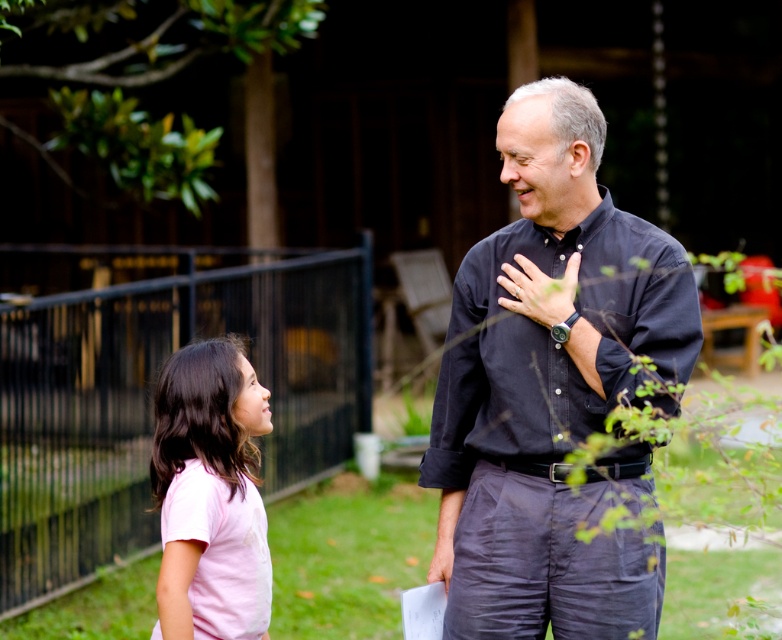
Does dark blue shirt at center have a greater height compared to pink cotton shirt at lower left?

Correct, dark blue shirt at center is much taller as pink cotton shirt at lower left.

Between dark blue shirt at center and pink cotton shirt at lower left, which one has less height?

With less height is pink cotton shirt at lower left.

Does point (474, 525) lie in front of point (246, 502)?

No, it is not.

Image resolution: width=782 pixels, height=640 pixels. I want to click on dark blue shirt at center, so click(x=551, y=392).

Can you confirm if pink cotton shirt at lower left is bigger than matte black watch at center?

Yes, pink cotton shirt at lower left is bigger than matte black watch at center.

Is pink cotton shirt at lower left taller than matte black watch at center?

Indeed, pink cotton shirt at lower left has a greater height compared to matte black watch at center.

Where is `pink cotton shirt at lower left`? This screenshot has width=782, height=640. pink cotton shirt at lower left is located at coordinates (210, 493).

Find the location of a particular element. The width and height of the screenshot is (782, 640). pink cotton shirt at lower left is located at coordinates (210, 493).

Is the position of dark blue shirt at center more distant than that of matte black watch at center?

No.

Is dark blue shirt at center smaller than matte black watch at center?

No, dark blue shirt at center is not smaller than matte black watch at center.

Identify the location of dark blue shirt at center. (551, 392).